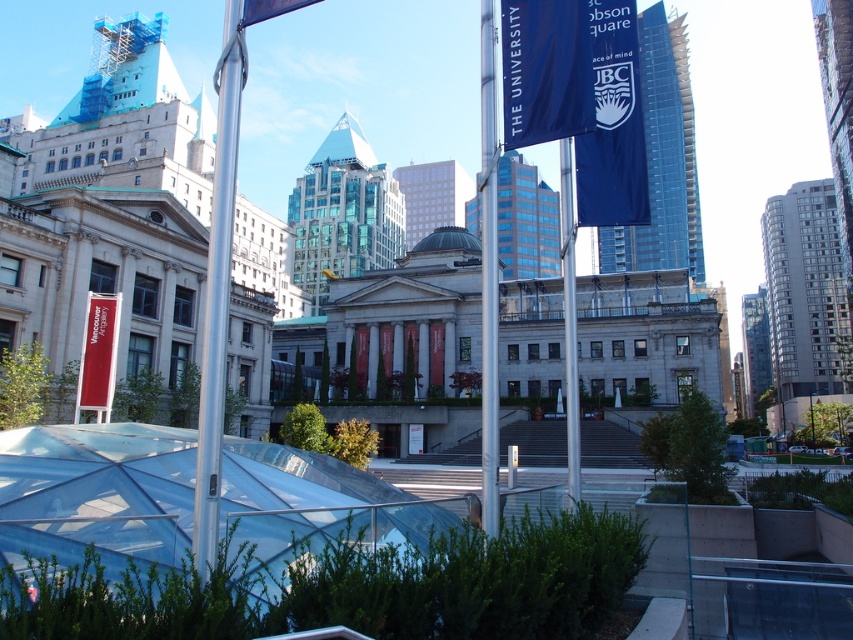
You are a city planner assessing the urban space. You need to place a new bench that is 1.2 meters wide between the polished silver pole at center and the blue fabric flag at upper center. Can the space between them accommodate the bench?

The polished silver pole at center is wider than the blue fabric flag at upper center. However, the description does not provide information about the distance between them. Therefore, it is impossible to determine if the bench will fit based on the given details.

You are a photographer standing in the urban setting described. You want to capture a photo that includes both the polished silver pole at center and the blue fabric flag at upper center. Based on their positions, will the pole block the view of the flag in your photo?

The polished silver pole at center is in front of the blue fabric flag at upper center, so the pole will block the view of the flag in the photo.